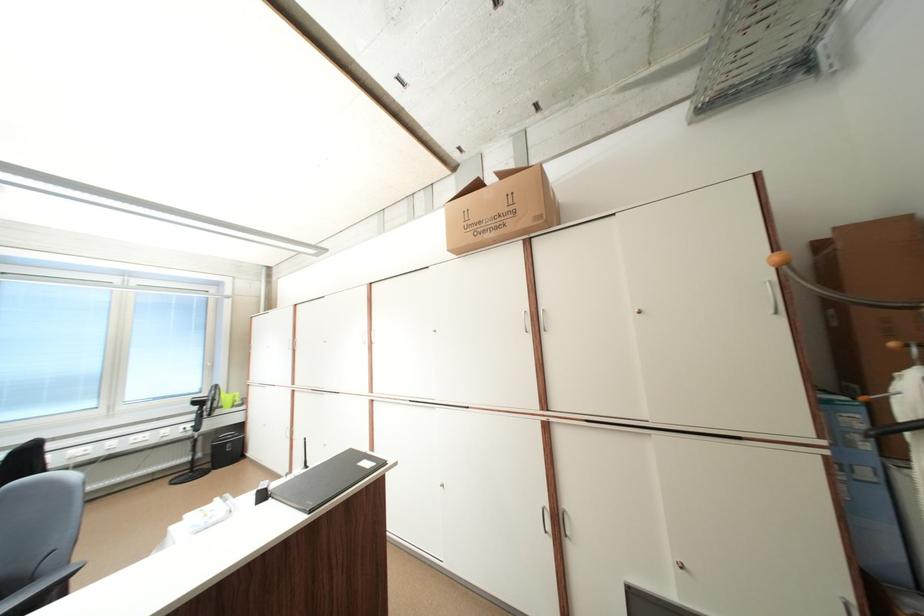
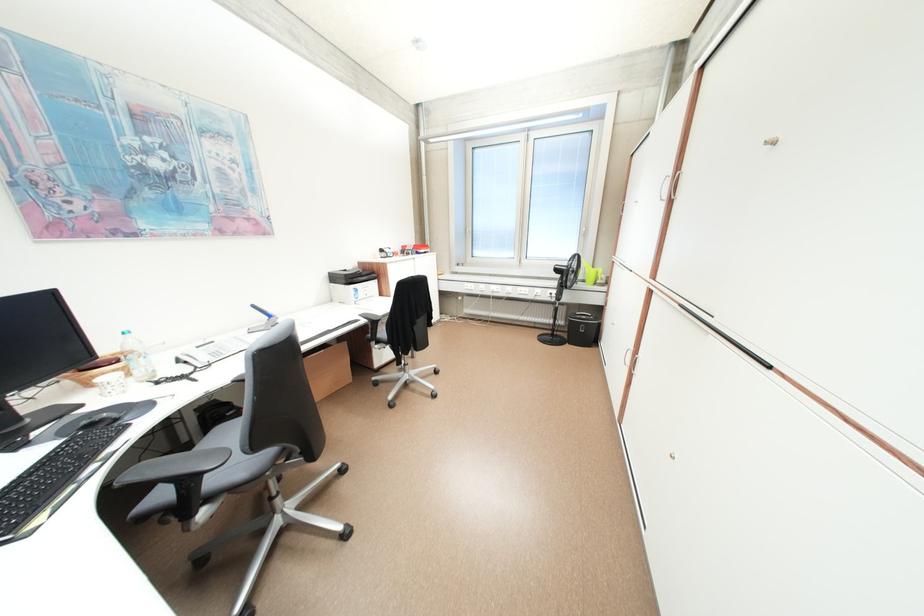
In the second image, find the point that corresponds to point (156, 435) in the first image.

(537, 290)